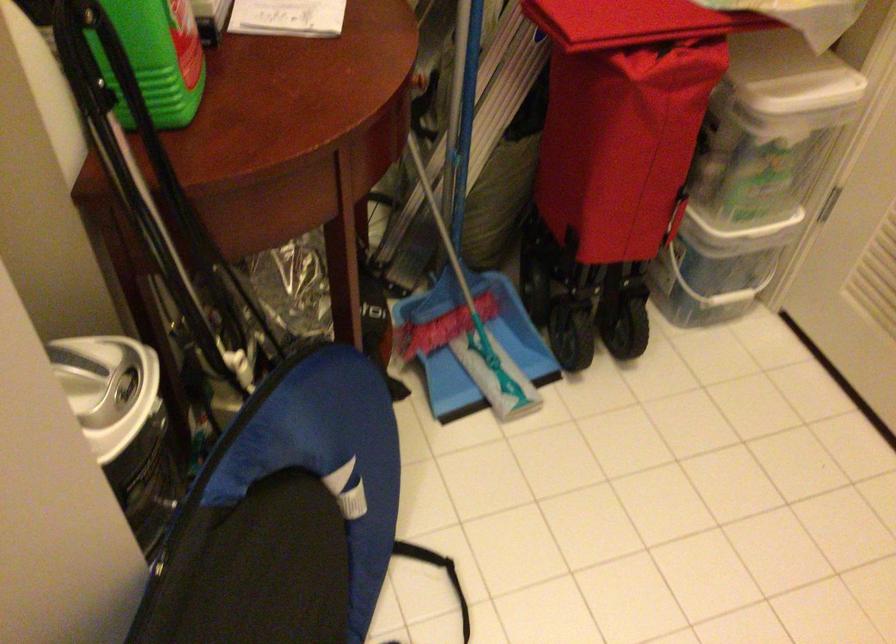
Describe the element at coordinates (123, 424) in the screenshot. I see `the trash can lid` at that location.